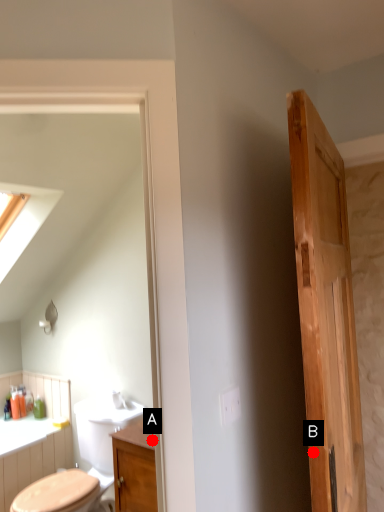
Question: Two points are circled on the image, labeled by A and B beside each circle. Among these points, which one is nearest to the camera?

Choices:
 (A) A is closer
 (B) B is closer

Answer: (B)